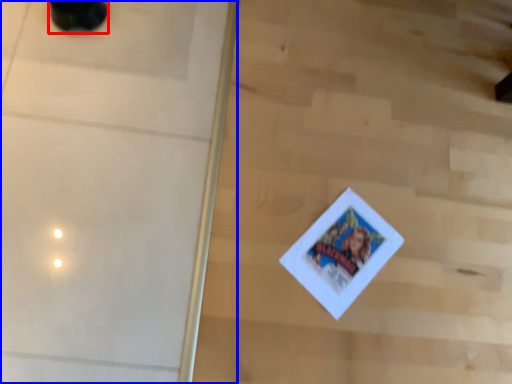
Question: Among these objects, which one is farthest to the camera, footwear (highlighted by a red box) or screen door (highlighted by a blue box)?

Choices:
 (A) footwear
 (B) screen door

Answer: (A)